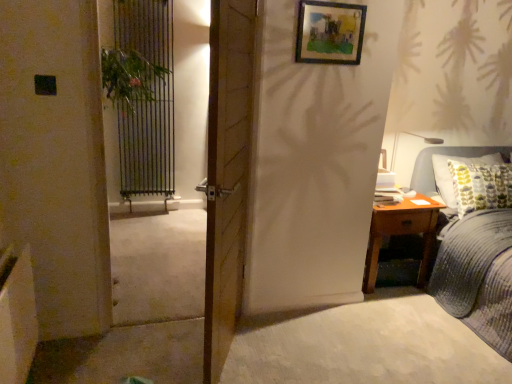
Identify the location of vacant space underneath green leafy plant at left (from a real-world perspective). click(145, 313).